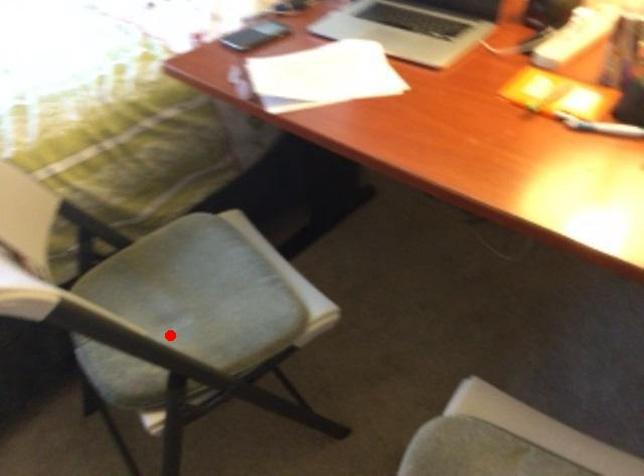
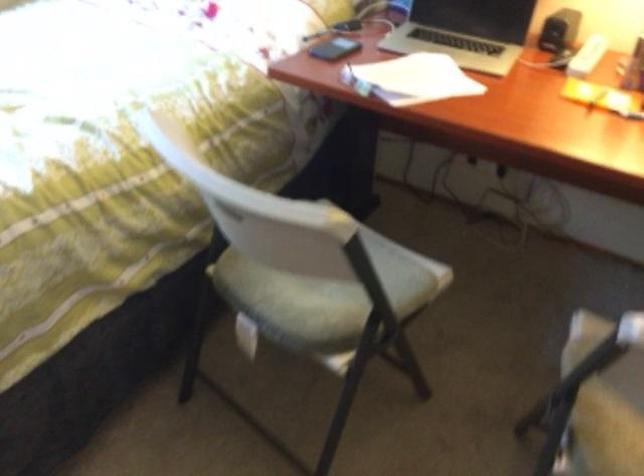
Question: I am providing you with two images of the same scene from different viewpoints. Given a red point in image1, look at the same physical point in image2. Is it:

Choices:
 (A) Closer to the viewpoint
 (B) Farther from the viewpoint

Answer: (B)